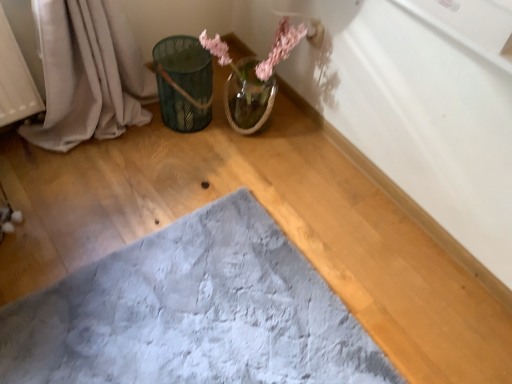
Identify the location of free area in between translucent glass vase at upper center and soft gray plush bath mat at center. The width and height of the screenshot is (512, 384). coord(221,186).